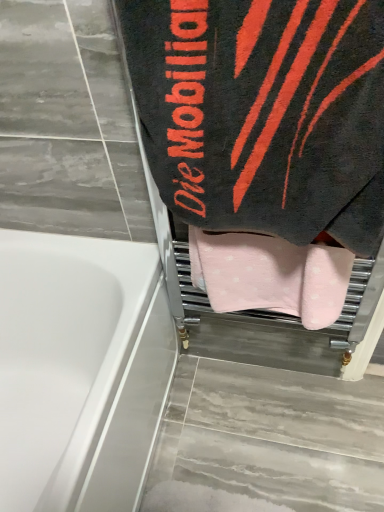
Question: Is pink soft towel at center, arranged as the first towel when ordered from the bottom, far away from white glossy bathtub at lower left?

Choices:
 (A) yes
 (B) no

Answer: (B)

Question: Can you confirm if pink soft towel at center, which appears as the second towel when viewed from the top, is shorter than white glossy bathtub at lower left?

Choices:
 (A) yes
 (B) no

Answer: (A)

Question: Is pink soft towel at center, which appears as the second towel when viewed from the top, directly adjacent to white glossy bathtub at lower left?

Choices:
 (A) no
 (B) yes

Answer: (A)

Question: From a real-world perspective, is pink soft towel at center, arranged as the first towel when ordered from the bottom, located beneath white glossy bathtub at lower left?

Choices:
 (A) yes
 (B) no

Answer: (B)

Question: Can you confirm if pink soft towel at center, which appears as the second towel when viewed from the top, is wider than white glossy bathtub at lower left?

Choices:
 (A) no
 (B) yes

Answer: (A)

Question: Based on their positions, is black terry cloth towel at upper right, positioned as the 1th towel in top-to-bottom order, located to the left or right of white glossy bathtub at lower left?

Choices:
 (A) left
 (B) right

Answer: (B)

Question: Considering the positions of point (127, 12) and point (29, 398), is point (127, 12) closer or farther from the camera than point (29, 398)?

Choices:
 (A) closer
 (B) farther

Answer: (A)

Question: Looking at the image, does black terry cloth towel at upper right, positioned as the 1th towel in top-to-bottom order, seem bigger or smaller compared to white glossy bathtub at lower left?

Choices:
 (A) small
 (B) big

Answer: (A)

Question: Is black terry cloth towel at upper right, positioned as the 1th towel in top-to-bottom order, situated inside white glossy bathtub at lower left or outside?

Choices:
 (A) outside
 (B) inside

Answer: (A)

Question: From the image's perspective, is white glossy bathtub at lower left above or below black terry cloth towel at upper right, arranged as the second towel when ordered from the bottom?

Choices:
 (A) above
 (B) below

Answer: (B)

Question: In terms of height, does white glossy bathtub at lower left look taller or shorter compared to black terry cloth towel at upper right, arranged as the second towel when ordered from the bottom?

Choices:
 (A) short
 (B) tall

Answer: (B)

Question: Is white glossy bathtub at lower left situated inside black terry cloth towel at upper right, positioned as the 1th towel in top-to-bottom order, or outside?

Choices:
 (A) inside
 (B) outside

Answer: (B)

Question: In terms of size, does white glossy bathtub at lower left appear bigger or smaller than black terry cloth towel at upper right, arranged as the second towel when ordered from the bottom?

Choices:
 (A) big
 (B) small

Answer: (A)

Question: Is black terry cloth towel at upper right, positioned as the 1th towel in top-to-bottom order, wider or thinner than pink soft towel at center, which appears as the second towel when viewed from the top?

Choices:
 (A) wide
 (B) thin

Answer: (A)

Question: Is black terry cloth towel at upper right, positioned as the 1th towel in top-to-bottom order, bigger or smaller than pink soft towel at center, which appears as the second towel when viewed from the top?

Choices:
 (A) big
 (B) small

Answer: (A)